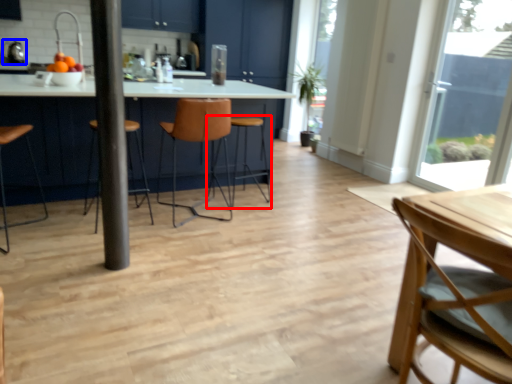
Question: Which point is further to the camera, bar stool (highlighted by a red box) or appliance (highlighted by a blue box)?

Choices:
 (A) bar stool
 (B) appliance

Answer: (B)